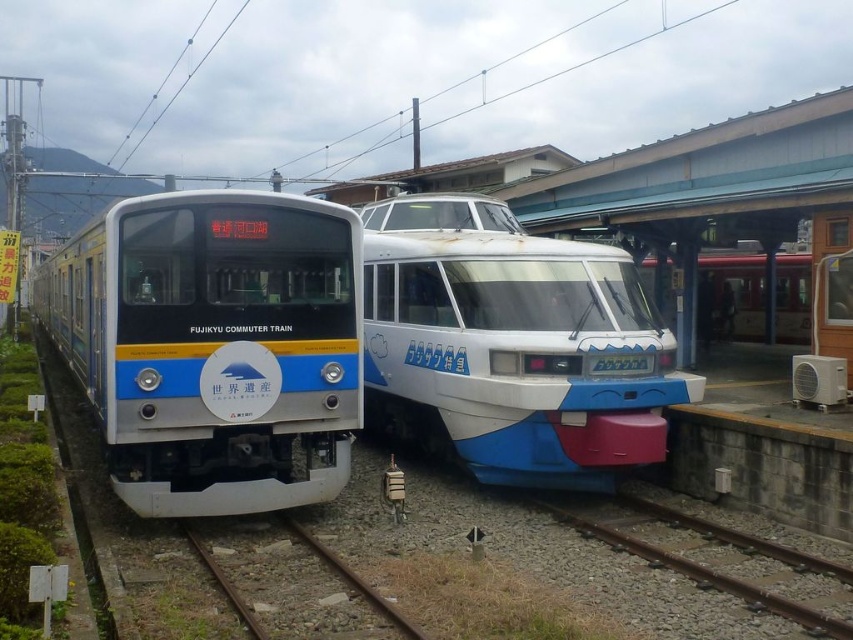
Question: Considering the real-world distances, which object is closest to the white glossy commuter train at left?

Choices:
 (A) brown gravel train track at center
 (B) brown gravel train track at lower center

Answer: (A)

Question: Which point appears closest to the camera in this image?

Choices:
 (A) (556, 256)
 (B) (656, 554)

Answer: (B)

Question: Is blue glossy train at center above brown gravel train track at lower center?

Choices:
 (A) no
 (B) yes

Answer: (B)

Question: Can you confirm if brown gravel train track at lower center is bigger than brown gravel train track at center?

Choices:
 (A) yes
 (B) no

Answer: (A)

Question: Is white glossy commuter train at left to the right of brown gravel train track at lower center from the viewer's perspective?

Choices:
 (A) yes
 (B) no

Answer: (B)

Question: Which object is closer to the camera taking this photo?

Choices:
 (A) blue glossy train at center
 (B) white glossy commuter train at left
 (C) brown gravel train track at center
 (D) brown gravel train track at lower center

Answer: (C)